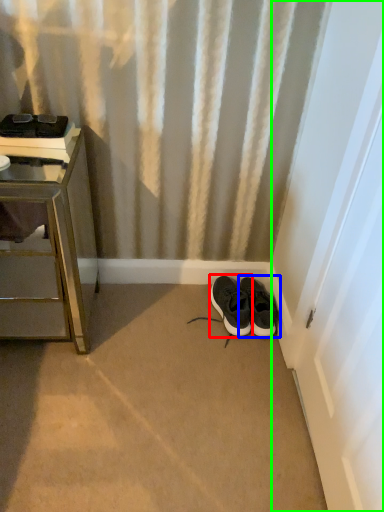
Question: Which is nearer to the footwear (highlighted by a red box)? footwear (highlighted by a blue box) or screen door (highlighted by a green box).

Choices:
 (A) footwear
 (B) screen door

Answer: (A)